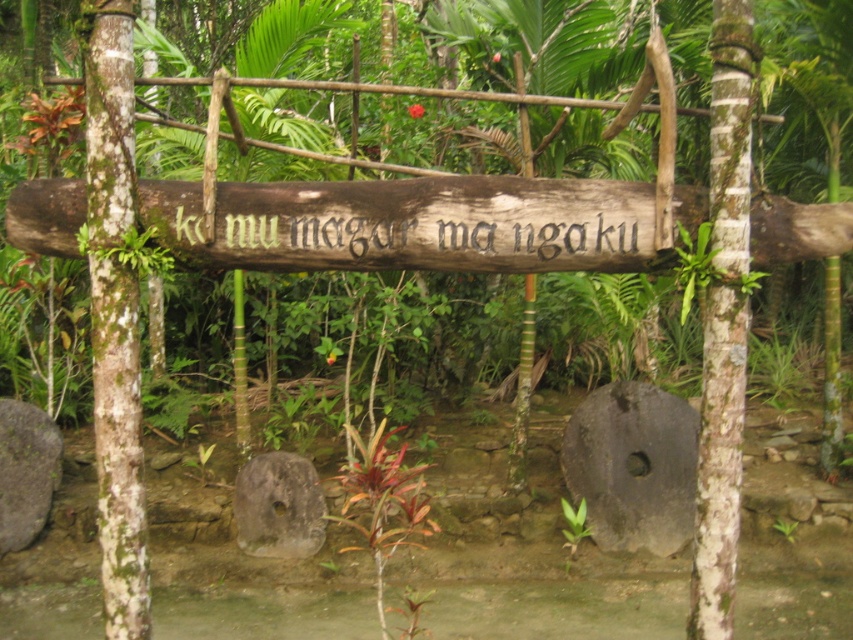
Does point (613, 225) come farther from viewer compared to point (123, 42)?

Yes, it is.

Between brown wooden sign at center and green mossy tree trunk at left, which one has less height?

Standing shorter between the two is brown wooden sign at center.

This screenshot has height=640, width=853. In order to click on brown wooden sign at center in this screenshot , I will do `click(410, 225)`.

Image resolution: width=853 pixels, height=640 pixels. I want to click on brown wooden sign at center, so click(x=410, y=225).

Does brown wooden sign at center come in front of dark gray stone at lower right?

Yes, it is in front of dark gray stone at lower right.

What do you see at coordinates (410, 225) in the screenshot? This screenshot has width=853, height=640. I see `brown wooden sign at center` at bounding box center [410, 225].

What are the coordinates of `brown wooden sign at center` in the screenshot? It's located at (410, 225).

From the picture: Between brown wooden sign at center and gray rough stone at lower left, which one has less height?

brown wooden sign at center

In the scene shown: Does brown wooden sign at center appear over gray rough stone at lower left?

Yes, brown wooden sign at center is above gray rough stone at lower left.

Which is in front, point (614, 269) or point (33, 528)?

Point (614, 269) is in front.

Locate an element on the screen. brown wooden sign at center is located at coordinates (410, 225).